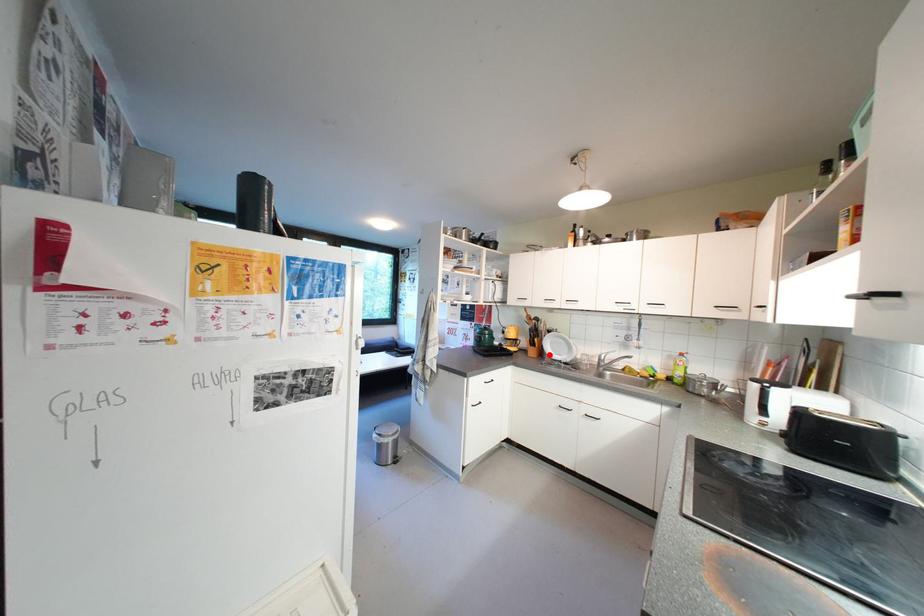
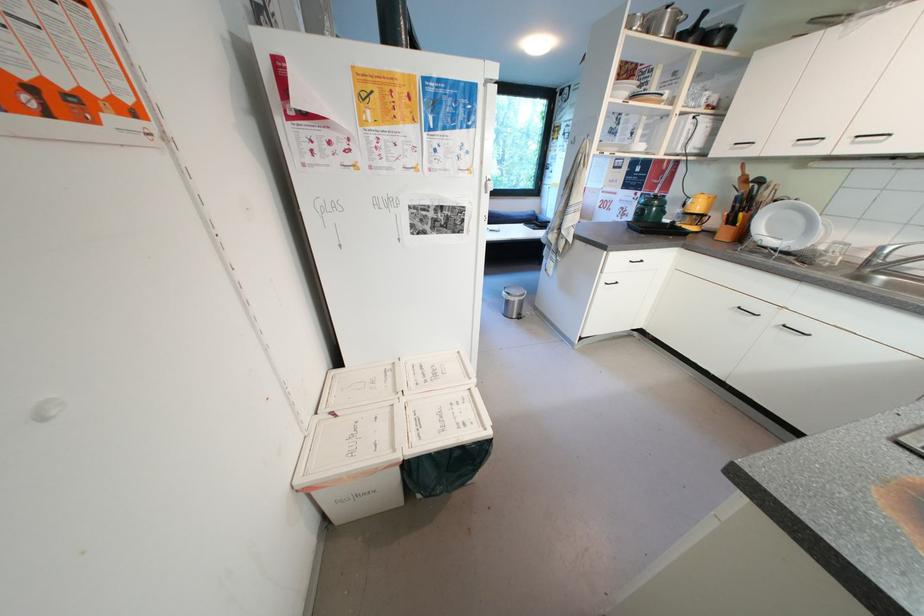
Question: I am providing you with two images of the same scene from different viewpoints. A red point is marked on the first image. At the location where the point appears in image 1, is it still visible in image 2?

Choices:
 (A) Yes
 (B) No

Answer: (A)